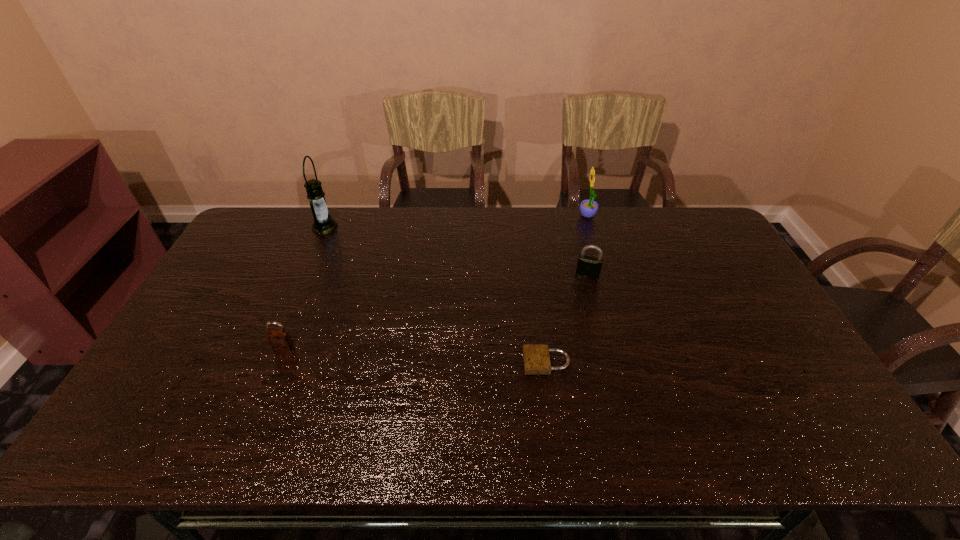
Locate an element on the screen. The height and width of the screenshot is (540, 960). vacant position located on the front-facing side of the sunflower is located at coordinates (477, 217).

The width and height of the screenshot is (960, 540). Identify the location of free spot located on the right of the third nearest object. (631, 274).

Image resolution: width=960 pixels, height=540 pixels. Identify the location of vacant space situated on the front-facing side of the leftmost padlock. (249, 435).

You are a GUI agent. You are given a task and a screenshot of the screen. Output one action in this format:
    pyautogui.click(x=<x>, y=<y>)
    Task: Click on the blank space located on the keyhole side of the shortest padlock
    
    Given the screenshot: What is the action you would take?
    pyautogui.click(x=372, y=362)

You are a GUI agent. You are given a task and a screenshot of the screen. Output one action in this format:
    pyautogui.click(x=<x>, y=<y>)
    Task: Click on the free spot located 0.260m on the keyhole side of the shortest padlock
    The image size is (960, 540).
    Given the screenshot: What is the action you would take?
    pyautogui.click(x=425, y=362)

Identify the location of vacant space situated 0.230m on the keyhole side of the shortest padlock. The height and width of the screenshot is (540, 960). (436, 362).

Image resolution: width=960 pixels, height=540 pixels. Identify the location of lantern situated at the far edge. (323, 223).

This screenshot has height=540, width=960. I want to click on sunflower present at the far edge, so click(588, 208).

The height and width of the screenshot is (540, 960). In order to click on vacant area at the far edge of the desktop in this screenshot , I will do `click(452, 242)`.

This screenshot has height=540, width=960. I want to click on vacant space at the near edge of the desktop, so click(x=427, y=436).